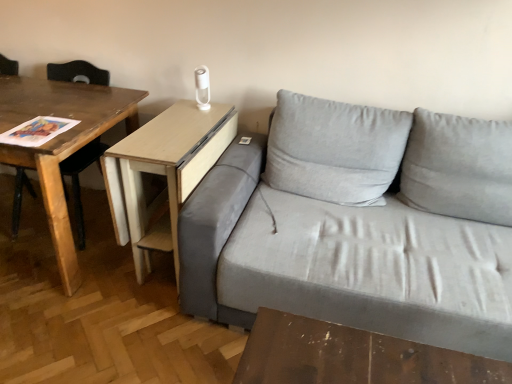
Question: Based on their sizes in the image, would you say light wood/woodenobject at center, which ranks as the first table in right-to-left order, is bigger or smaller than gray fabric couch at center?

Choices:
 (A) small
 (B) big

Answer: (A)

Question: Is point (175, 125) positioned closer to the camera than point (181, 271)?

Choices:
 (A) farther
 (B) closer

Answer: (A)

Question: Considering the real-world distances, which object is farthest from the gray fabric couch at center?

Choices:
 (A) light wood/woodenobject at center, which ranks as the first table in right-to-left order
 (B) wooden table at left, which is the 1th table in left-to-right order

Answer: (B)

Question: Estimate the real-world distances between objects in this image. Which object is farther from the wooden table at left, arranged as the 2th table when viewed from the right?

Choices:
 (A) light wood/woodenobject at center, which ranks as the first table in right-to-left order
 (B) gray fabric couch at center

Answer: (B)